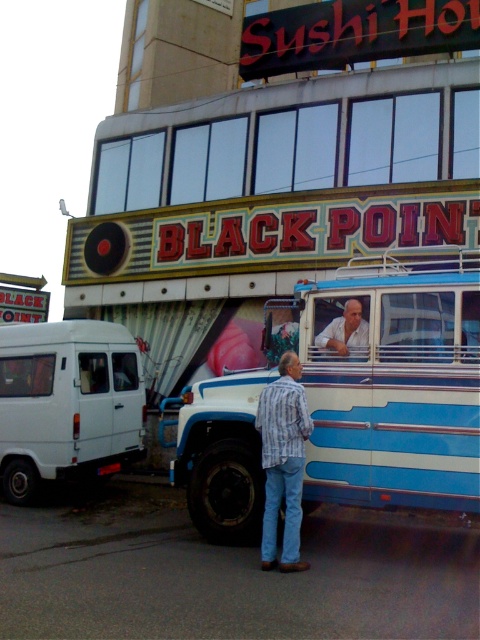
Question: Which of the following is the farthest from the observer?

Choices:
 (A) white shirt at center
 (B) blue striped bus at center

Answer: (A)

Question: Estimate the real-world distances between objects in this image. Which object is closer to the white matte van at left?

Choices:
 (A) blue striped bus at center
 (B) striped shirt at center

Answer: (B)

Question: Which object is the closest to the white shirt at center?

Choices:
 (A) striped shirt at center
 (B) white matte van at left
 (C) blue striped bus at center

Answer: (C)

Question: Can you confirm if white matte van at left is positioned above striped shirt at center?

Choices:
 (A) yes
 (B) no

Answer: (B)

Question: Can you confirm if blue striped bus at center is positioned to the right of white shirt at center?

Choices:
 (A) yes
 (B) no

Answer: (A)

Question: Can you confirm if striped shirt at center is positioned above white shirt at center?

Choices:
 (A) no
 (B) yes

Answer: (A)